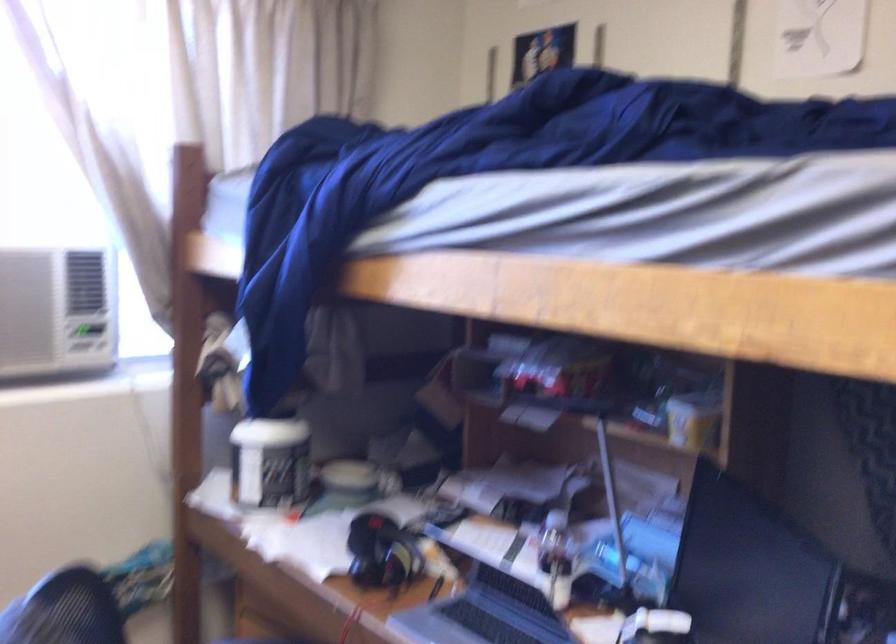
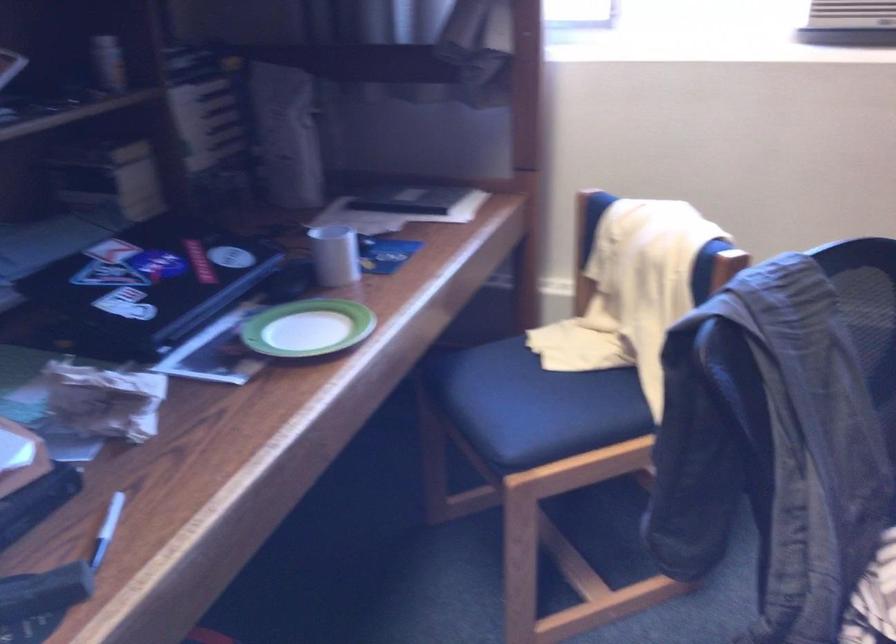
Consider the image. Based on the continuous images, in which direction is the camera rotating?

The camera rotated toward left-down.